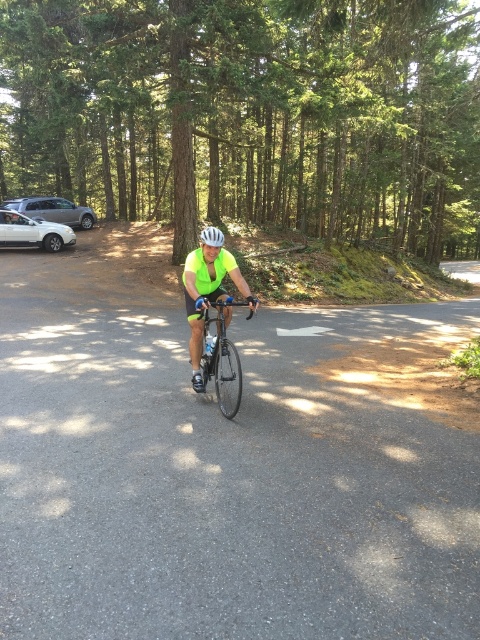
You are a delivery driver who needs to pass the shiny black bicycle at center on the road. The silver metallic sedan at left is parked on the side. Can you safely pass the bicycle without moving the parked car?

The shiny black bicycle at center is smaller than the silver metallic sedan at left, so there should be enough space between the parked car and the road to safely pass the bicycle without moving the parked car.

Consider the image. You are a photographer trying to capture the cyclist and their gear. You want to ensure both the shiny black bicycle at center and the white matte bicycle helmet at center are clearly visible in the frame. Given their sizes, which object should you focus on first to ensure it doesn t get cropped out?

The white matte bicycle helmet at center occupies more space than the shiny black bicycle at center, so you should focus on ensuring the white matte bicycle helmet at center is positioned properly to avoid cropping, as it is larger.

You are a cyclist on the road and see two points marked on the image. The first point is at coordinates point (216, 392) and the second point is at point (216, 244). Which point is closer to your current position if you are facing forward along the road?

Point (216, 244) is closer to your current position because it is in front of point (216, 392), which is behind it.